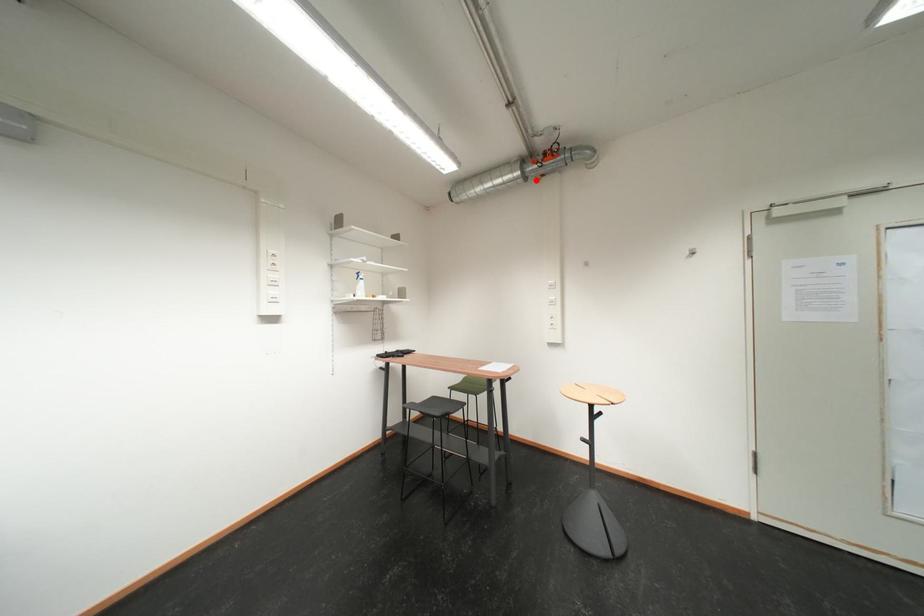
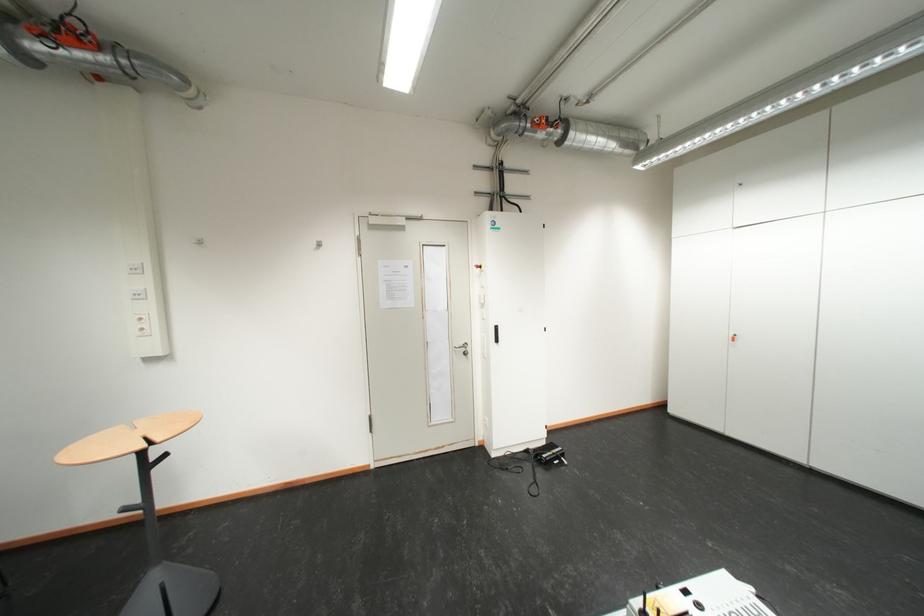
The point at the highlighted location is marked in the first image. Where is the corresponding point in the second image?

(35, 60)